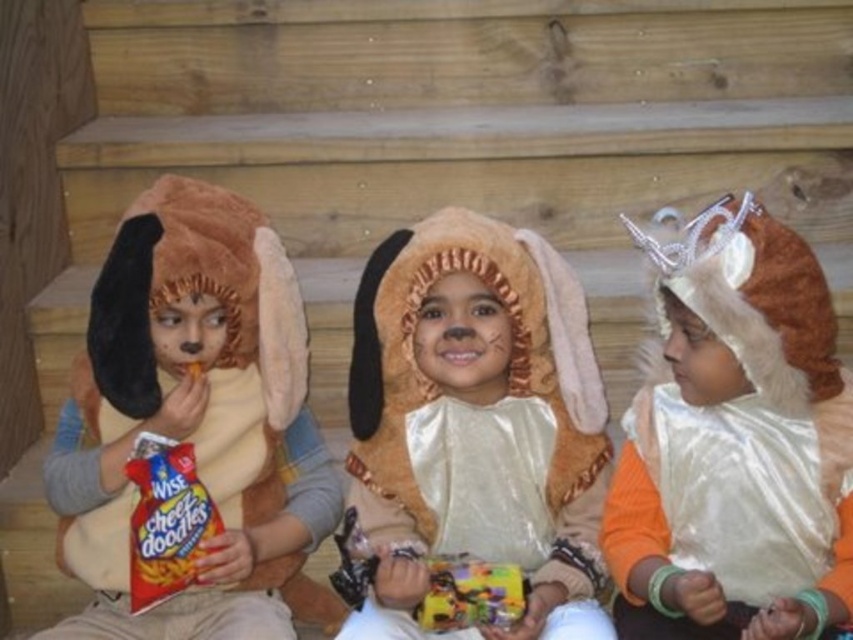
Between fuzzy beige costume at center and white shiny cape at center, which one appears on the right side from the viewer's perspective?

white shiny cape at center

From the picture: Who is more distant from viewer, (x=363, y=460) or (x=769, y=518)?

Point (x=363, y=460)

The width and height of the screenshot is (853, 640). I want to click on fuzzy beige costume at center, so click(476, 426).

Is fuzzy tan costume at center to the left of white shiny cape at center from the viewer's perspective?

Yes, fuzzy tan costume at center is to the left of white shiny cape at center.

This screenshot has height=640, width=853. Identify the location of fuzzy tan costume at center. (196, 412).

Which is more to the right, fuzzy beige costume at center or matte brown plush dog at left?

fuzzy beige costume at center

Does point (589, 544) come closer to viewer compared to point (273, 300)?

Yes, point (589, 544) is closer to viewer.

I want to click on fuzzy beige costume at center, so click(476, 426).